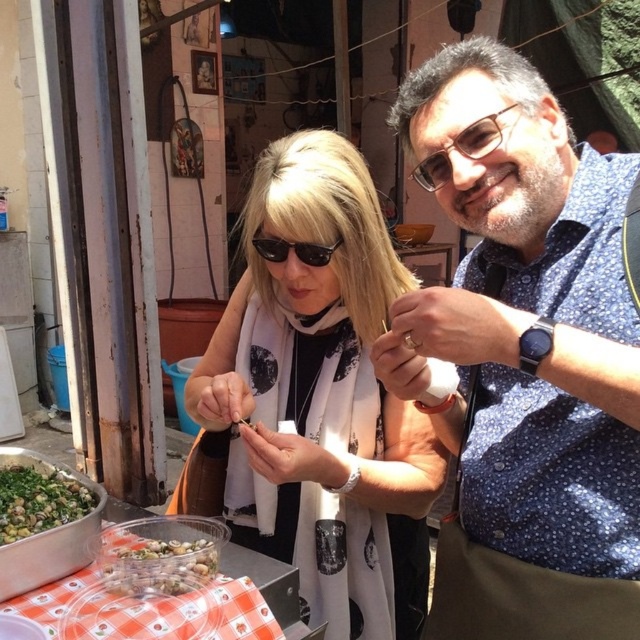
Which is in front, point (432, 161) or point (268, 237)?

Point (432, 161) is more forward.

Is point (497, 128) more distant than point (269, 244)?

No, (497, 128) is closer to viewer.

Is point (492, 122) farther from camera compared to point (339, 241)?

That is False.

You are a GUI agent. You are given a task and a screenshot of the screen. Output one action in this format:
    pyautogui.click(x=<x>, y=<y>)
    Task: Click on the matte black glasses at upper center
    This screenshot has height=640, width=640.
    Given the screenshot: What is the action you would take?
    pyautogui.click(x=461, y=148)

Can you confirm if white matte scarf at center is positioned above matte black glasses at upper center?

Actually, white matte scarf at center is below matte black glasses at upper center.

Does white matte scarf at center have a lesser width compared to matte black glasses at upper center?

No.

Identify the location of white matte scarf at center. The image size is (640, 640). (321, 397).

Can you confirm if translucent plastic container at lower left is positioned to the left of black plastic sunglasses at center?

Correct, you'll find translucent plastic container at lower left to the left of black plastic sunglasses at center.

Which is more to the right, translucent plastic container at lower left or black plastic sunglasses at center?

black plastic sunglasses at center is more to the right.

Is point (125, 534) more distant than point (269, 237)?

No.

Identify the location of translucent plastic container at lower left. (156, 561).